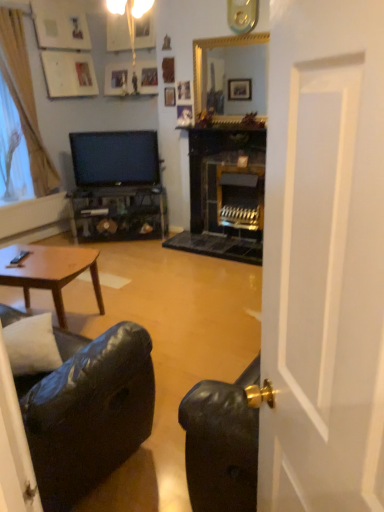
Question: Is wooden picture frame at upper center wider or thinner than matte black tv at center?

Choices:
 (A) wide
 (B) thin

Answer: (B)

Question: Is wooden picture frame at upper center in front of or behind matte black tv at center in the image?

Choices:
 (A) front
 (B) behind

Answer: (B)

Question: Which object is the farthest from the white soft pillow at lower left?

Choices:
 (A) brown wooden coffee table at lower left
 (B) black leather couch at lower left
 (C) silky yellow curtain at left
 (D) matte black tv at center
 (E) gold-framed mirror at upper center

Answer: (C)

Question: Considering the real-world distances, which object is farthest from the gold-framed mirror at upper center?

Choices:
 (A) brown wooden coffee table at lower left
 (B) silky yellow curtain at left
 (C) black leather couch at lower left
 (D) white soft pillow at lower left
 (E) matte black tv at center

Answer: (C)